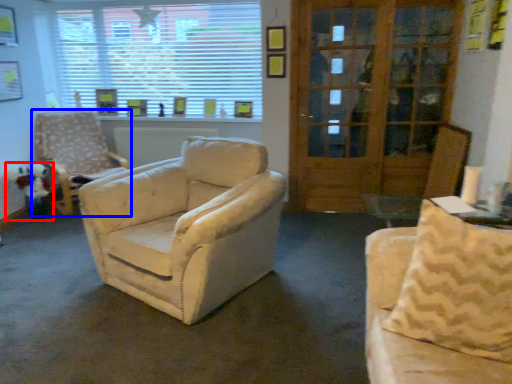
Question: Which object appears farthest to the camera in this image, toy (highlighted by a red box) or chair (highlighted by a blue box)?

Choices:
 (A) toy
 (B) chair

Answer: (A)